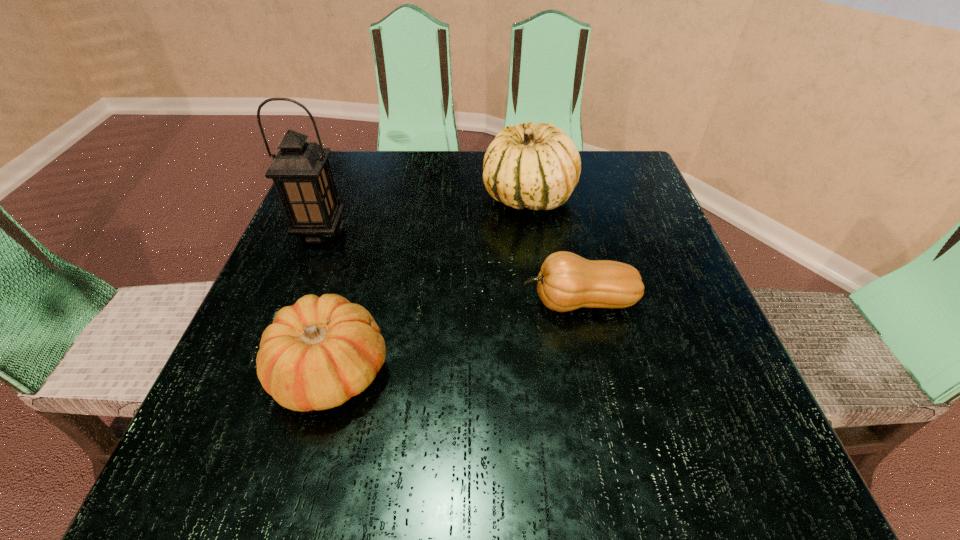
Find the location of a particular element. free space between the third farthest object and the leftmost gourd is located at coordinates (456, 337).

This screenshot has width=960, height=540. I want to click on object that is the third closest to the second nearest object, so click(301, 172).

I want to click on object identified as the closest to the tallest object, so click(x=318, y=353).

Locate an element on the screen. The image size is (960, 540). gourd that stands as the closest to the tallest gourd is located at coordinates (567, 281).

Choose which gourd is the second nearest neighbor to the lantern. Please provide its 2D coordinates. Your answer should be formatted as a tuple, i.e. [(x, y)], where the tuple contains the x and y coordinates of a point satisfying the conditions above.

[(537, 167)]